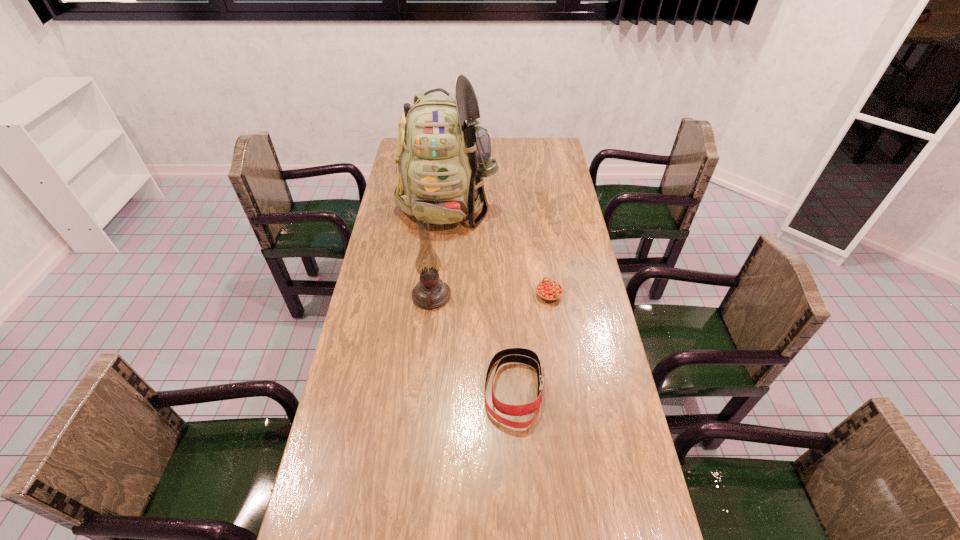
The image size is (960, 540). I want to click on free space between the rightmost object and the oil lamp, so click(491, 295).

The width and height of the screenshot is (960, 540). What are the coordinates of `vacant space that's between the nearest object and the third shortest object` in the screenshot? It's located at (473, 343).

Identify the location of empty location between the nearest object and the second tallest object. This screenshot has height=540, width=960. (473, 343).

Locate an element on the screen. The width and height of the screenshot is (960, 540). vacant space that's between the strawberry and the oil lamp is located at coordinates (491, 295).

Identify which object is the third closest to the strawberry. Please provide its 2D coordinates. Your answer should be formatted as a tuple, i.e. [(x, y)], where the tuple contains the x and y coordinates of a point satisfying the conditions above.

[(431, 292)]

Locate which object is the third closest to the nearest object. Please provide its 2D coordinates. Your answer should be formatted as a tuple, i.e. [(x, y)], where the tuple contains the x and y coordinates of a point satisfying the conditions above.

[(442, 156)]

Find the location of a particular element. The height and width of the screenshot is (540, 960). vacant space that satisfies the following two spatial constraints: 1. on the back side of the rightmost object; 2. on the right side of the nearest object is located at coordinates (509, 295).

Where is `blank space that satisfies the following two spatial constraints: 1. on the front-facing side of the tallest object; 2. on the right side of the nearest object`? This screenshot has height=540, width=960. blank space that satisfies the following two spatial constraints: 1. on the front-facing side of the tallest object; 2. on the right side of the nearest object is located at coordinates (432, 390).

The height and width of the screenshot is (540, 960). Find the location of `free space that satisfies the following two spatial constraints: 1. on the back side of the strawberry; 2. on the right side of the dog collar`. free space that satisfies the following two spatial constraints: 1. on the back side of the strawberry; 2. on the right side of the dog collar is located at coordinates (509, 295).

Where is `vacant point that satisfies the following two spatial constraints: 1. on the front side of the dog collar; 2. on the left side of the third shortest object`? The width and height of the screenshot is (960, 540). vacant point that satisfies the following two spatial constraints: 1. on the front side of the dog collar; 2. on the left side of the third shortest object is located at coordinates (422, 390).